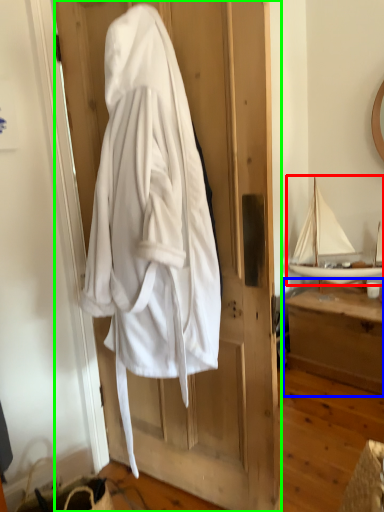
Question: Which object is positioned farthest from boat (highlighted by a red box)? Select from furniture (highlighted by a blue box) and door (highlighted by a green box).

Choices:
 (A) furniture
 (B) door

Answer: (B)